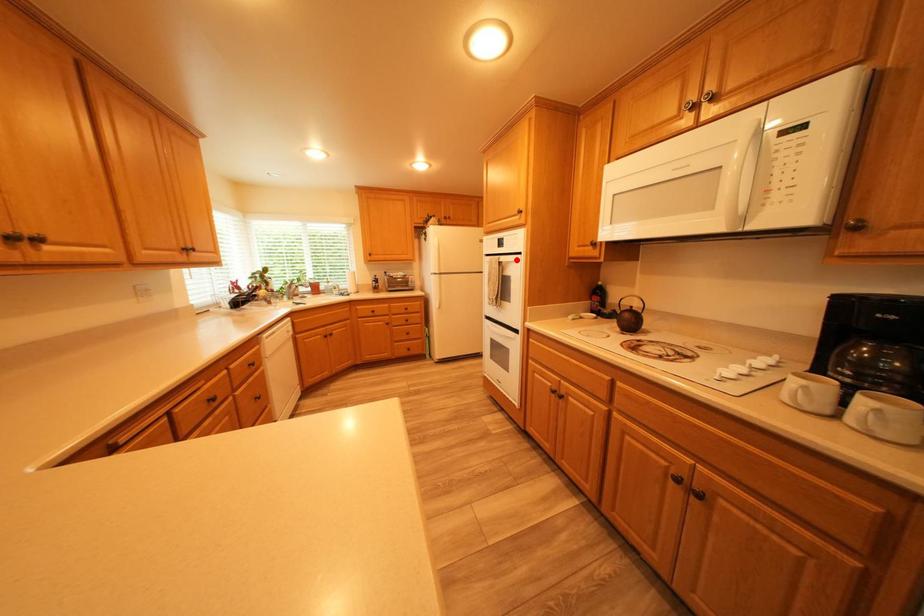
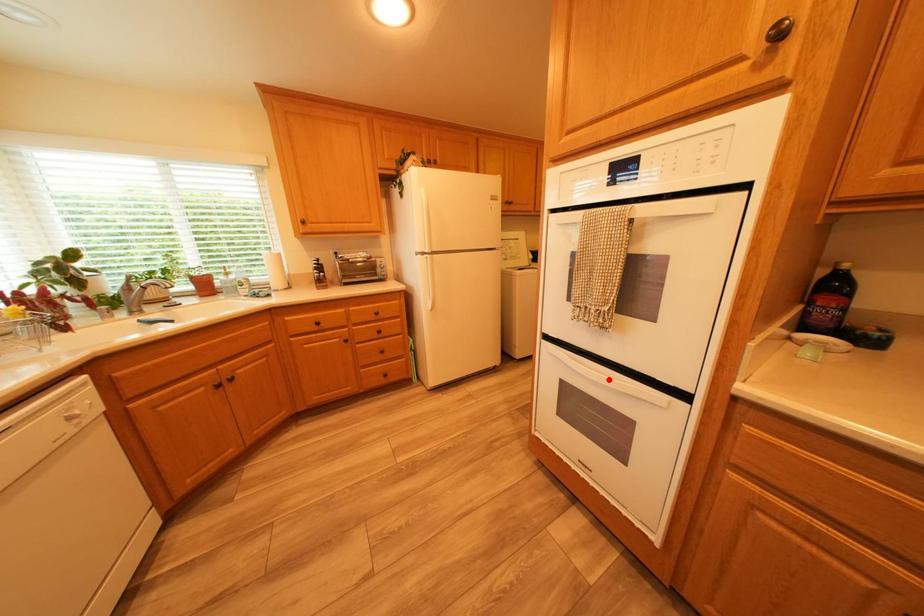
Consider the image. I am providing you with two images of the same scene from different viewpoints. A red point is marked on the first image and another point is marked on the second image. Are the points marked in image1 and image2 representing the same 3D position?

No